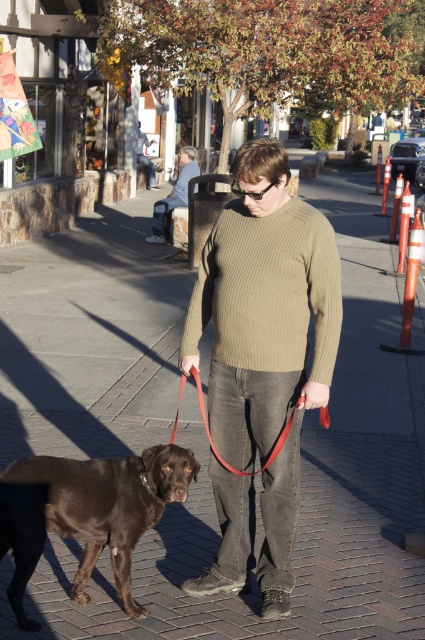
Question: Which of these objects is positioned farthest from the matte brown sweater at center?

Choices:
 (A) gray fabric jacket at upper center
 (B) red leather leash at center
 (C) olive ribbed sweater at center

Answer: (B)

Question: Which object appears farthest from the camera in this image?

Choices:
 (A) red leather leash at center
 (B) matte brown sweater at center
 (C) gray fabric jacket at upper center
 (D) olive ribbed sweater at center

Answer: (B)

Question: Which object is the closest to the red leather leash at center?

Choices:
 (A) matte brown sweater at center
 (B) gray fabric jacket at upper center
 (C) olive ribbed sweater at center

Answer: (C)

Question: Is knit sweater at center thinner than olive ribbed sweater at center?

Choices:
 (A) no
 (B) yes

Answer: (A)

Question: Is olive ribbed sweater at center positioned before shiny brown dog at lower left?

Choices:
 (A) no
 (B) yes

Answer: (A)

Question: Considering the relative positions of olive ribbed sweater at center and gray fabric jacket at upper center in the image provided, where is olive ribbed sweater at center located with respect to gray fabric jacket at upper center?

Choices:
 (A) above
 (B) below

Answer: (B)